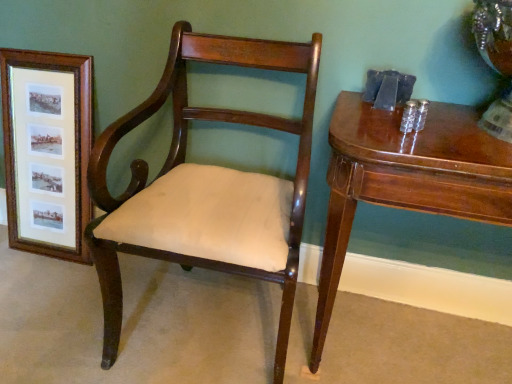
Question: Could you tell me if glossy wood table at right is turned towards wooden framed prints at left?

Choices:
 (A) no
 (B) yes

Answer: (A)

Question: Does glossy wood table at right have a smaller size compared to wooden framed prints at left?

Choices:
 (A) yes
 (B) no

Answer: (B)

Question: From the image's perspective, would you say glossy wood table at right is positioned over wooden framed prints at left?

Choices:
 (A) no
 (B) yes

Answer: (A)

Question: Would you consider glossy wood table at right to be distant from wooden framed prints at left?

Choices:
 (A) yes
 (B) no

Answer: (A)

Question: Does glossy wood table at right have a larger size compared to wooden framed prints at left?

Choices:
 (A) yes
 (B) no

Answer: (A)

Question: Is wooden framed prints at left at the back of glossy wood table at right?

Choices:
 (A) no
 (B) yes

Answer: (A)

Question: Does mahogany wood chair at center have a greater width compared to wooden framed prints at left?

Choices:
 (A) yes
 (B) no

Answer: (A)

Question: Considering the relative sizes of mahogany wood chair at center and wooden framed prints at left in the image provided, is mahogany wood chair at center taller than wooden framed prints at left?

Choices:
 (A) yes
 (B) no

Answer: (A)

Question: From a real-world perspective, does mahogany wood chair at center sit lower than wooden framed prints at left?

Choices:
 (A) yes
 (B) no

Answer: (B)

Question: From the image's perspective, is mahogany wood chair at center below wooden framed prints at left?

Choices:
 (A) yes
 (B) no

Answer: (A)

Question: From the image's perspective, would you say mahogany wood chair at center is positioned over wooden framed prints at left?

Choices:
 (A) yes
 (B) no

Answer: (B)

Question: Can you confirm if mahogany wood chair at center is bigger than wooden framed prints at left?

Choices:
 (A) yes
 (B) no

Answer: (A)

Question: Does wooden framed prints at left have a lesser width compared to mahogany wood chair at center?

Choices:
 (A) yes
 (B) no

Answer: (A)